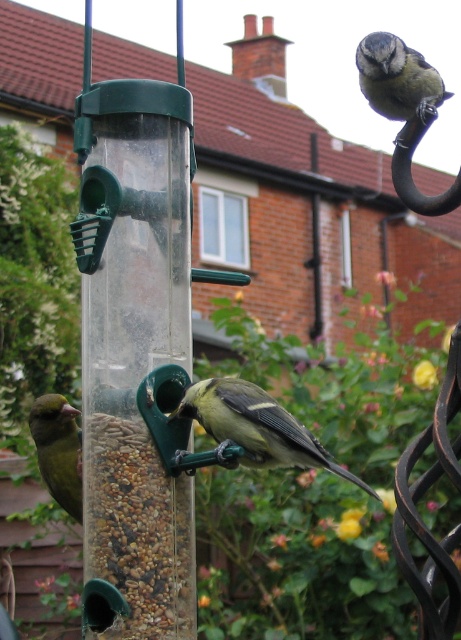
You are a birder observing the garden scene. You notice two birds near the bird feeder. Which bird is higher up in the image, the blue speckled bird at upper right or the green matte bird at left?

The blue speckled bird at upper right is positioned over the green matte bird at left, so it is higher up in the image.

You are standing in the garden looking at the bird feeder. There are two points marked on the feeder. One is at coordinate point (236, 390) and the other is at point (395, 93). Which of these two points is closer to your viewpoint?

Point (236, 390) is closer to the camera than point (395, 93).

Based on the photo, you are a birdwatcher observing the garden scene. You notice two birds at the bird feeder. Which bird is smaller in size between the blue speckled bird at upper right and the green matte bird at left?

The blue speckled bird at upper right is smaller in size compared to the green matte bird at left.